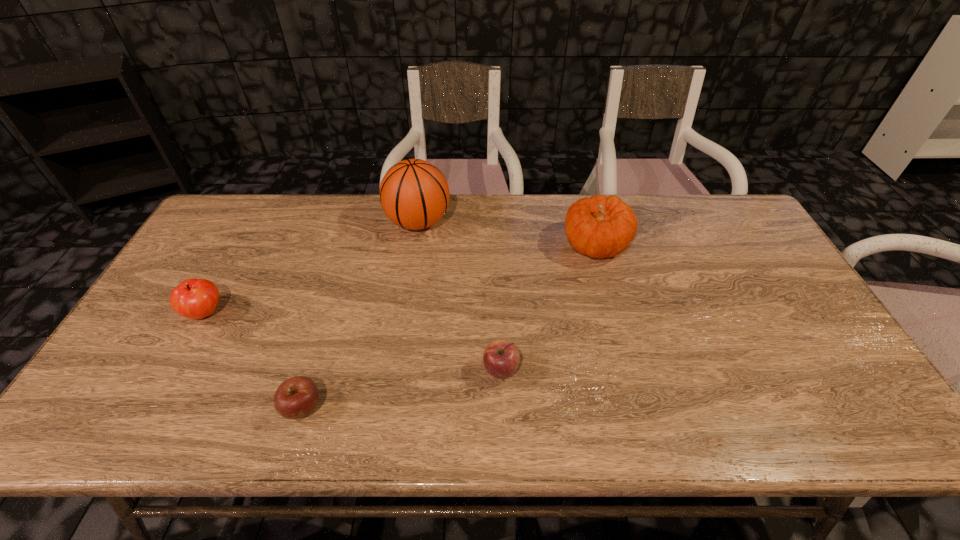
Find the location of `free region located 0.050m on the left of the tallest object`. free region located 0.050m on the left of the tallest object is located at coordinates (371, 222).

Locate an element on the screen. free space located 0.240m on the front of the pumpkin is located at coordinates (620, 334).

This screenshot has width=960, height=540. In order to click on free space located on the back of the farthest apple in this screenshot , I will do `click(258, 217)`.

Where is `vacant area located on the right of the rightmost apple`? vacant area located on the right of the rightmost apple is located at coordinates (646, 370).

You are a GUI agent. You are given a task and a screenshot of the screen. Output one action in this format:
    pyautogui.click(x=<x>, y=<y>)
    Task: Click on the basketball that is at the far edge
    The image size is (960, 540).
    Given the screenshot: What is the action you would take?
    pyautogui.click(x=414, y=194)

I want to click on pumpkin located at the far edge, so click(600, 227).

Where is `object that is at the near edge`? The height and width of the screenshot is (540, 960). object that is at the near edge is located at coordinates (297, 397).

Find the location of a particular element. The image size is (960, 540). object present at the left edge is located at coordinates coord(193,298).

The image size is (960, 540). I want to click on vacant space at the far edge of the desktop, so click(513, 201).

Locate an element on the screen. This screenshot has height=540, width=960. vacant area at the near edge of the desktop is located at coordinates (323, 421).